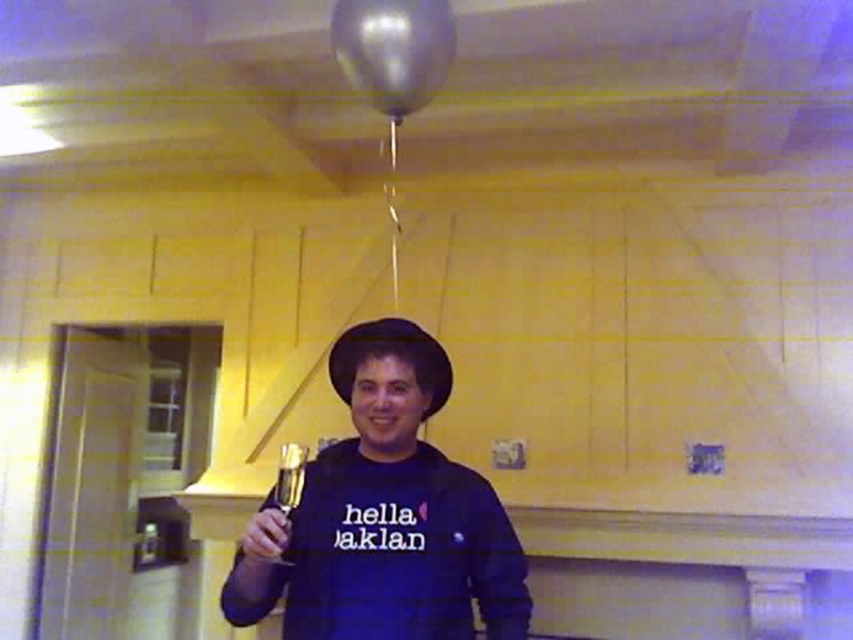
You are standing in the room and want to place a small decoration exactly at the point marked as point (x=384, y=516). What object is located at that point?

The point (x=384, y=516) corresponds to the matte black hat at center, so placing the decoration there would place it on the matte black hat at center.

You are an interior designer planning to hang a picture frame at point coordinates of 0.808, 0.451. The matte black hat at center is currently at that location. Can you hang the frame there without moving the hat?

The matte black hat at center is located at point coordinates of [384,516], so you cannot hang the picture frame there without moving the hat.

You are planning to hang a small picture frame between the matte black hat at center and the transparent metallic balloon at upper center. Based on their positions, which object should the frame be closer to?

The matte black hat at center is to the right of the transparent metallic balloon at upper center, so the frame should be placed closer to the transparent metallic balloon at upper center to maintain symmetry.